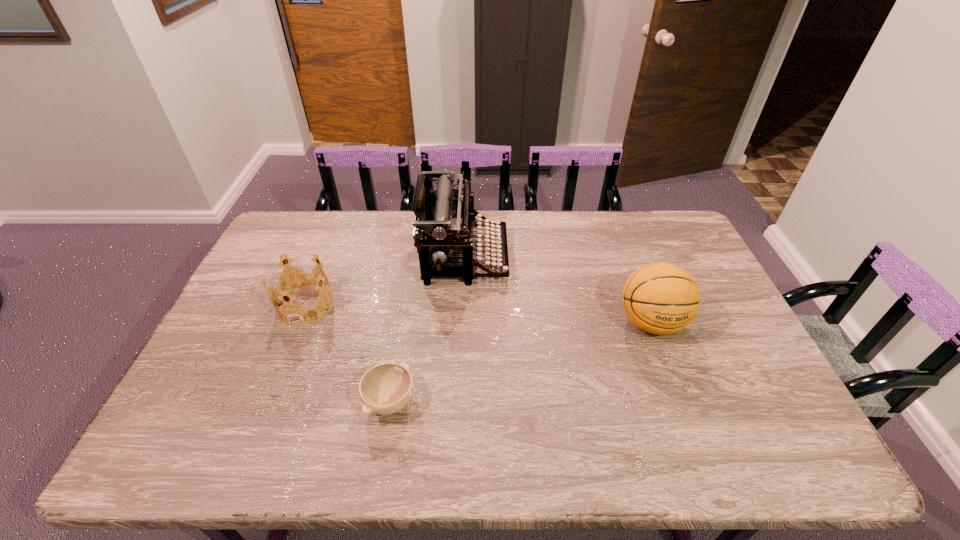
In order to click on unoccupied area between the typewriter and the basketball in this screenshot , I will do `click(558, 289)`.

Where is `object identified as the closest to the bowl`? object identified as the closest to the bowl is located at coordinates (296, 282).

Identify which object is the nearest to the tallest object. Please provide its 2D coordinates. Your answer should be formatted as a tuple, i.e. [(x, y)], where the tuple contains the x and y coordinates of a point satisfying the conditions above.

[(296, 282)]

Image resolution: width=960 pixels, height=540 pixels. In order to click on free spot that satisfies the following two spatial constraints: 1. on the typing side of the tallest object; 2. on the front side of the crown in this screenshot , I will do `click(463, 305)`.